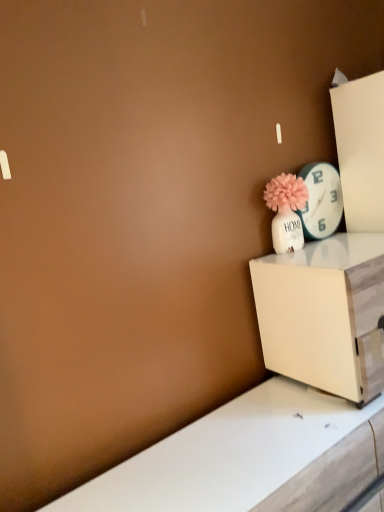
The width and height of the screenshot is (384, 512). What are the coordinates of `vacant space to the right of matte white vase with pink flower at upper right` in the screenshot? It's located at (355, 247).